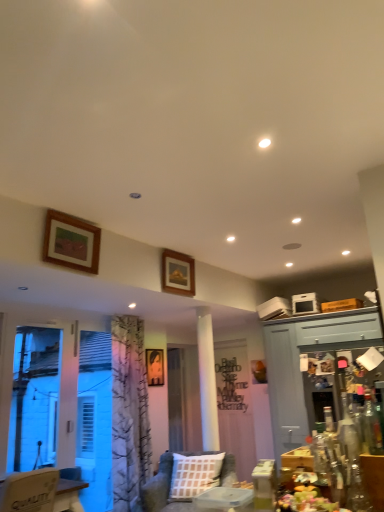
Question: From a real-world perspective, does wooden picture frame at upper center, placed as the 2th picture frame when sorted from top to bottom, stand above transparent glass bottle at lower right?

Choices:
 (A) yes
 (B) no

Answer: (A)

Question: Is wooden picture frame at upper center, the 1th picture frame from the right, next to transparent glass bottle at lower right and touching it?

Choices:
 (A) yes
 (B) no

Answer: (B)

Question: From the image's perspective, is wooden picture frame at upper center, the second picture frame when ordered from back to front, beneath transparent glass bottle at lower right?

Choices:
 (A) no
 (B) yes

Answer: (A)

Question: Considering the relative positions of wooden picture frame at upper center, which appears as the 3th picture frame when viewed from the left, and transparent glass bottle at lower right in the image provided, is wooden picture frame at upper center, which appears as the 3th picture frame when viewed from the left, in front of transparent glass bottle at lower right?

Choices:
 (A) no
 (B) yes

Answer: (A)

Question: Considering the relative positions of wooden picture frame at upper center, the 2th picture frame positioned from the front, and transparent glass bottle at lower right in the image provided, is wooden picture frame at upper center, the 2th picture frame positioned from the front, to the right of transparent glass bottle at lower right from the viewer's perspective?

Choices:
 (A) yes
 (B) no

Answer: (B)

Question: From a real-world perspective, relative to transparent plastic screen door at center, acting as the 3th screen door starting from the right, is matte wooden picture frame at center, positioned as the second picture frame in left-to-right order, vertically above or below?

Choices:
 (A) above
 (B) below

Answer: (A)

Question: Visually, is matte wooden picture frame at center, positioned as the second picture frame in left-to-right order, positioned to the left or to the right of transparent plastic screen door at center, placed as the first screen door when sorted from back to front?

Choices:
 (A) left
 (B) right

Answer: (A)

Question: Considering their positions, is matte wooden picture frame at center, which ranks as the 1th picture frame in back-to-front order, located in front of or behind transparent plastic screen door at center, acting as the 3th screen door starting from the right?

Choices:
 (A) behind
 (B) front

Answer: (B)

Question: Considering the positions of matte wooden picture frame at center, the 3th picture frame when ordered from top to bottom, and transparent plastic screen door at center, placed as the 2th screen door when sorted from left to right, in the image, is matte wooden picture frame at center, the 3th picture frame when ordered from top to bottom, wider or thinner than transparent plastic screen door at center, placed as the 2th screen door when sorted from left to right,?

Choices:
 (A) wide
 (B) thin

Answer: (B)

Question: In terms of size, does metallic silver screen door at right, the 4th screen door from the left, appear bigger or smaller than transparent plastic screen door at center, the fourth screen door positioned from the front?

Choices:
 (A) small
 (B) big

Answer: (A)

Question: From the image's perspective, relative to transparent plastic screen door at center, acting as the 3th screen door starting from the right, is metallic silver screen door at right, the third screen door from the back, above or below?

Choices:
 (A) above
 (B) below

Answer: (A)

Question: Considering the positions of metallic silver screen door at right, the third screen door from the back, and transparent plastic screen door at center, the fourth screen door positioned from the front, in the image, is metallic silver screen door at right, the third screen door from the back, wider or thinner than transparent plastic screen door at center, the fourth screen door positioned from the front,?

Choices:
 (A) thin
 (B) wide

Answer: (B)

Question: From their relative heights in the image, would you say metallic silver screen door at right, the third screen door from the back, is taller or shorter than transparent plastic screen door at center, placed as the first screen door when sorted from back to front?

Choices:
 (A) tall
 (B) short

Answer: (B)

Question: From their relative heights in the image, would you say white plastic screen door at lower left, positioned as the fourth screen door in back-to-front order, is taller or shorter than metallic silver screen door at right, which appears as the 2th screen door when viewed from the front?

Choices:
 (A) short
 (B) tall

Answer: (B)

Question: Do you think white plastic screen door at lower left, positioned as the fourth screen door in back-to-front order, is within metallic silver screen door at right, the third screen door from the back, or outside of it?

Choices:
 (A) outside
 (B) inside

Answer: (A)